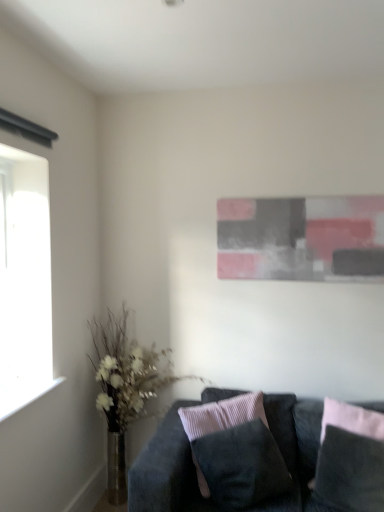
Question: In the image, is abstract painting at upper center positioned in front of or behind suede-like black pillow at center, which is the 1th pillow from left to right?

Choices:
 (A) front
 (B) behind

Answer: (B)

Question: From a real-world perspective, relative to suede-like black pillow at center, which is the 1th pillow from left to right, is abstract painting at upper center vertically above or below?

Choices:
 (A) above
 (B) below

Answer: (A)

Question: Considering the real-world distances, which object is farthest from the transparent glass window at left?

Choices:
 (A) suede-like black pillow at center, which is the 1th pillow from left to right
 (B) translucent glass vase at left
 (C) suede black couch at lower right
 (D) abstract painting at upper center
 (E) velvet dark gray pillow at lower right, which ranks as the 2th pillow in left-to-right order

Answer: (E)

Question: Which object is the farthest from the suede black couch at lower right?

Choices:
 (A) velvet dark gray pillow at lower right, which appears as the 1th pillow when viewed from the right
 (B) transparent glass window at left
 (C) abstract painting at upper center
 (D) translucent glass vase at left
 (E) suede-like black pillow at center, the 2th pillow from the right

Answer: (B)